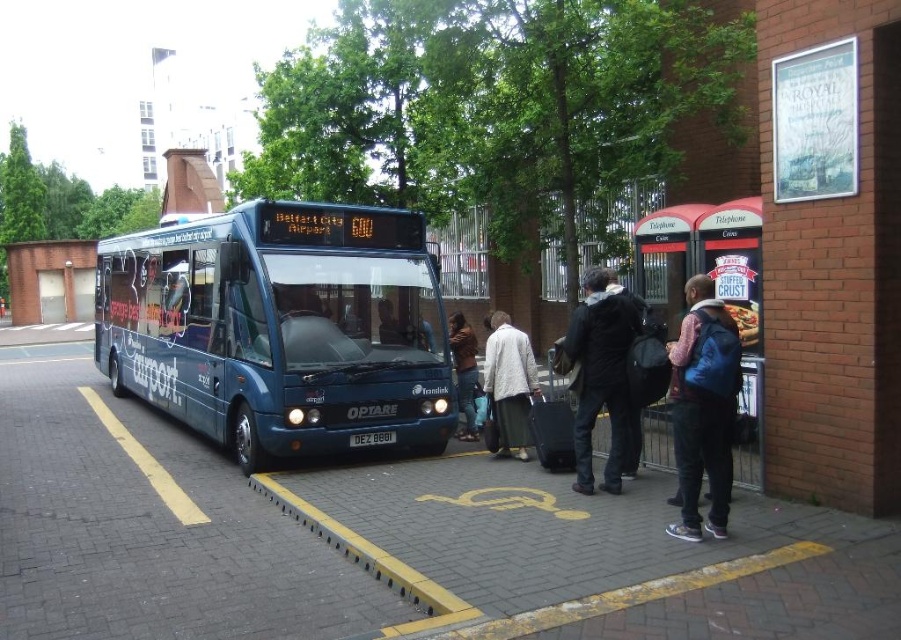
Question: Is blue backpack at center positioned in front of brown leather jacket at center?

Choices:
 (A) yes
 (B) no

Answer: (A)

Question: Estimate the real-world distances between objects in this image. Which object is closer to the metallic red phone booth at right?

Choices:
 (A) blue backpack at center
 (B) brown leather jacket at center

Answer: (A)

Question: Is blue metallic bus at center closer to camera compared to metallic red phone booth at right?

Choices:
 (A) no
 (B) yes

Answer: (A)

Question: Does metallic red phone booth at right appear on the right side of blue backpack at center?

Choices:
 (A) yes
 (B) no

Answer: (A)

Question: Which object is the farthest from the brown leather jacket at center?

Choices:
 (A) metallic red phone booth at right
 (B) dark blue jacket at center
 (C) blue metallic bus at center

Answer: (C)

Question: Which of the following is the closest to the observer?

Choices:
 (A) (721, 275)
 (B) (622, 404)
 (C) (432, 605)

Answer: (C)